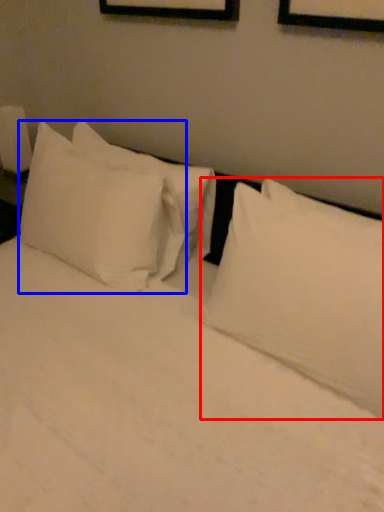
Question: Which object is closer to the camera taking this photo, pillow (highlighted by a red box) or pillow (highlighted by a blue box)?

Choices:
 (A) pillow
 (B) pillow

Answer: (A)